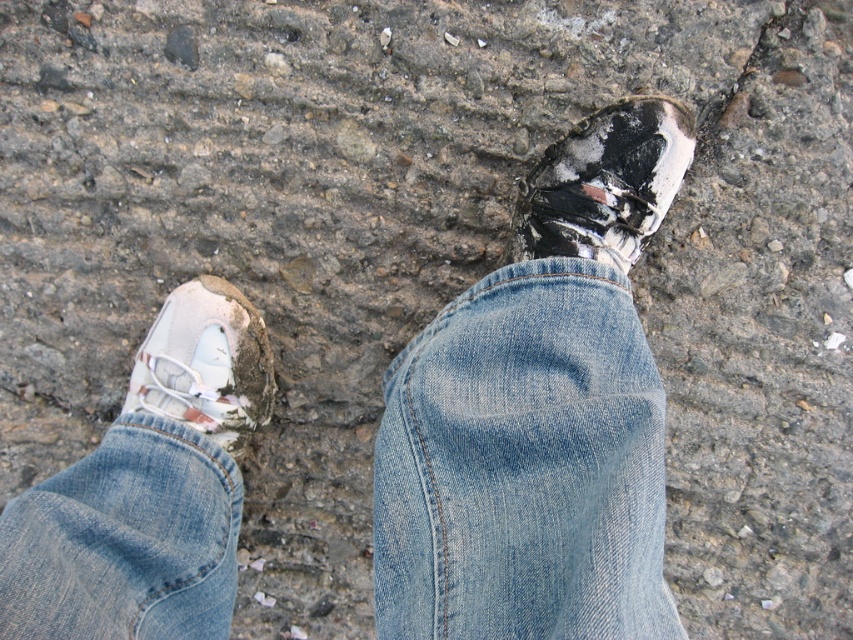
Question: Among these objects, which one is farthest from the camera?

Choices:
 (A) light blue denim jeans at center
 (B) denim at center
 (C) light blue denim jeans at lower left
 (D) white matte shoe at upper right

Answer: (D)

Question: Considering the relative positions of denim at center and light blue denim jeans at lower left in the image provided, where is denim at center located with respect to light blue denim jeans at lower left?

Choices:
 (A) right
 (B) left

Answer: (A)

Question: Among these points, which one is farthest from the camera?

Choices:
 (A) (515, 621)
 (B) (183, 349)

Answer: (B)

Question: Does denim at center have a smaller size compared to light blue denim jeans at lower left?

Choices:
 (A) no
 (B) yes

Answer: (A)

Question: Which of the following is the farthest from the observer?

Choices:
 (A) (527, 636)
 (B) (389, 394)
 (C) (79, 592)
 (D) (256, 356)

Answer: (D)

Question: Is light blue denim jeans at center smaller than white matte shoe at lower left?

Choices:
 (A) no
 (B) yes

Answer: (A)